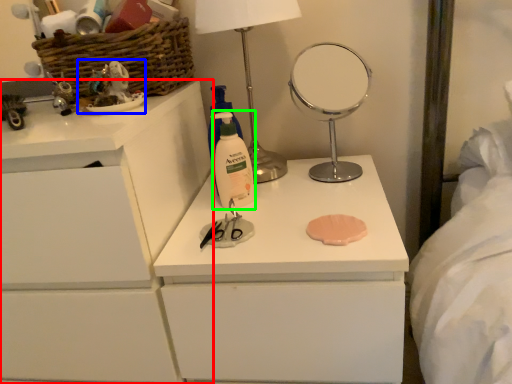
Question: Which is nearer to the chest of drawers (highlighted by a red box)? toy (highlighted by a blue box) or cleaning product (highlighted by a green box).

Choices:
 (A) toy
 (B) cleaning product

Answer: (A)